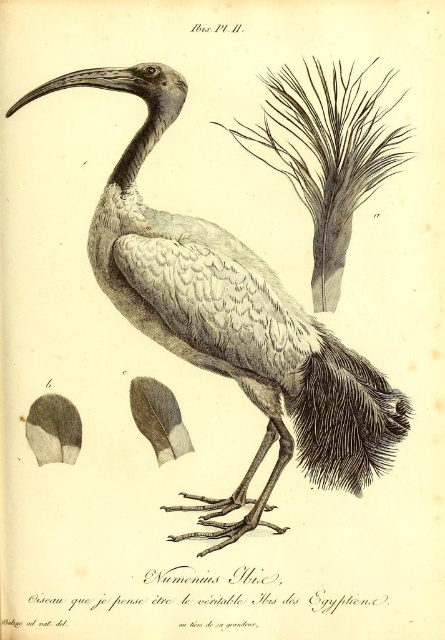
In the scene shown: You are an ornithologist examining this botanical illustration. You need to determine the spatial relationship between the gray feathered bird at center and the dark gray textured feathers at lower right. Which object is wider?

The gray feathered bird at center is wider than the dark gray textured feathers at lower right.

In the botanical illustration of the ibis, there is a point labeled as point [231,321]. What does this point represent?

The point [231,321] represents the gray feathered bird at center.